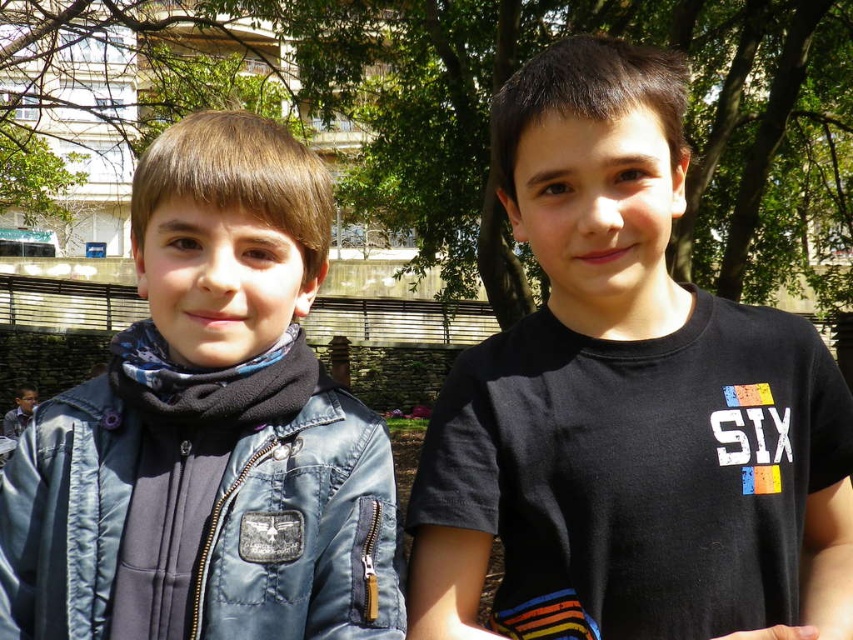
Question: Is black matte shirt at center further to camera compared to brushed denim jacket at left?

Choices:
 (A) no
 (B) yes

Answer: (B)

Question: Which of the following is the farthest from the observer?

Choices:
 (A) black matte shirt at center
 (B) brushed denim jacket at left

Answer: (A)

Question: Can you confirm if black matte shirt at center is positioned above brushed denim jacket at left?

Choices:
 (A) yes
 (B) no

Answer: (A)

Question: Does black matte shirt at center appear over brushed denim jacket at left?

Choices:
 (A) yes
 (B) no

Answer: (A)

Question: Which point appears closest to the camera in this image?

Choices:
 (A) (380, 422)
 (B) (695, 392)

Answer: (A)

Question: Which of the following is the farthest from the observer?

Choices:
 (A) (608, 326)
 (B) (28, 476)

Answer: (A)